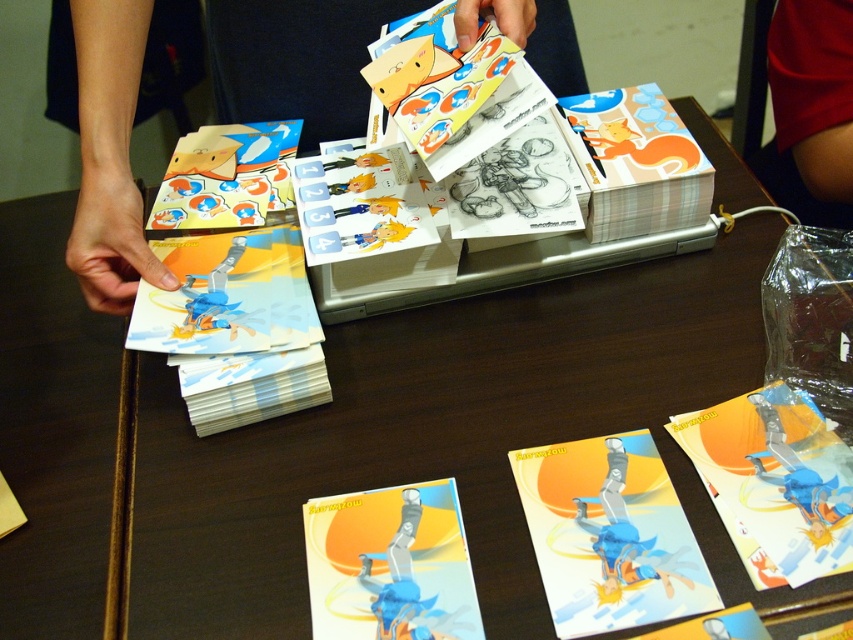
Does matte paper card at center appear on the left side of matte plastic cards at left?

No, matte paper card at center is not to the left of matte plastic cards at left.

Does matte paper card at center lie in front of matte plastic cards at left?

Yes, matte paper card at center is in front of matte plastic cards at left.

I want to click on matte paper card at center, so click(x=608, y=534).

Who is shorter, matte plastic card at center or red fabric shorts at lower right?

matte plastic card at center

Who is more forward, (380,515) or (770,156)?

Positioned in front is point (380,515).

You are a GUI agent. You are given a task and a screenshot of the screen. Output one action in this format:
    pyautogui.click(x=<x>, y=<y>)
    Task: Click on the matte plastic card at center
    This screenshot has width=853, height=640.
    Given the screenshot: What is the action you would take?
    pyautogui.click(x=390, y=564)

Can you confirm if matte paper cards at center is positioned to the left of matte plastic cards at left?

In fact, matte paper cards at center is to the right of matte plastic cards at left.

Can you confirm if matte paper cards at center is positioned to the right of matte plastic cards at left?

Yes, matte paper cards at center is to the right of matte plastic cards at left.

The width and height of the screenshot is (853, 640). What do you see at coordinates (450, 436) in the screenshot?
I see `matte paper cards at center` at bounding box center [450, 436].

At what (x,y) coordinates should I click in order to perform the action: click on matte paper cards at center. Please return your answer as a coordinate pair (x, y). Looking at the image, I should click on (450, 436).